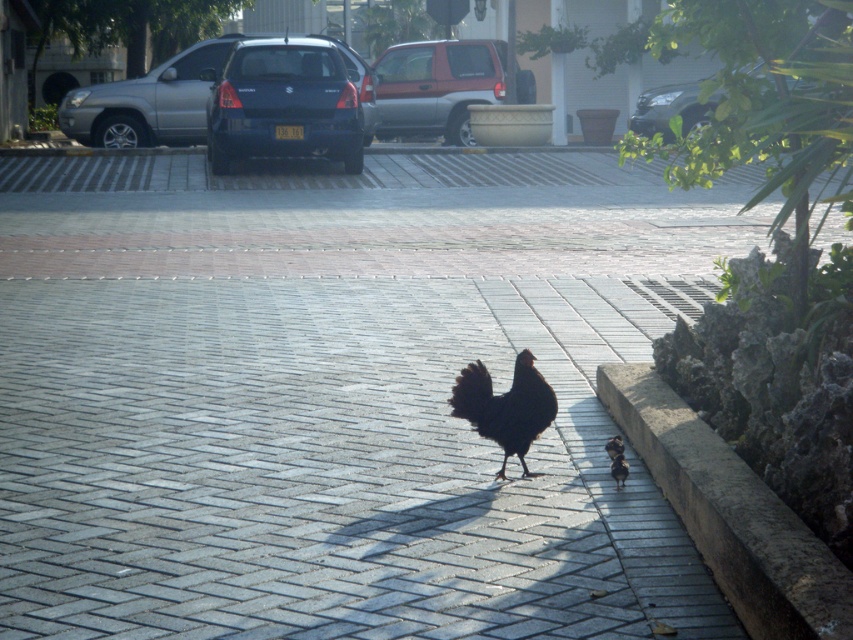
You are a delivery person needing to park your vehicle in the space between the maroon metallic suv at center and the black feathered chicken at lower right. Can your 2.5 meter wide delivery van fit in the space between them?

The maroon metallic suv at center is wider than the black feathered chicken at lower right, but the exact width of the space between them isn

What are the coordinates of the matte black car at center?

The coordinates of the matte black car at center are at point (149, 100).

You are standing at the point labeled point (270, 60) and want to walk to the point labeled point (430, 48). Which direction should you face to walk directly towards your destination?

You should face downward because point (430, 48) is further away from the camera compared to point (270, 60).